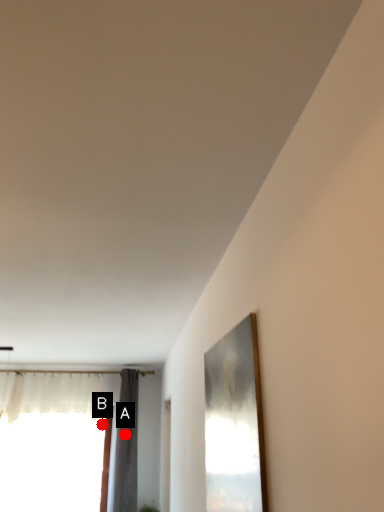
Question: Two points are circled on the image, labeled by A and B beside each circle. Among these points, which one is nearest to the camera?

Choices:
 (A) A is closer
 (B) B is closer

Answer: (B)